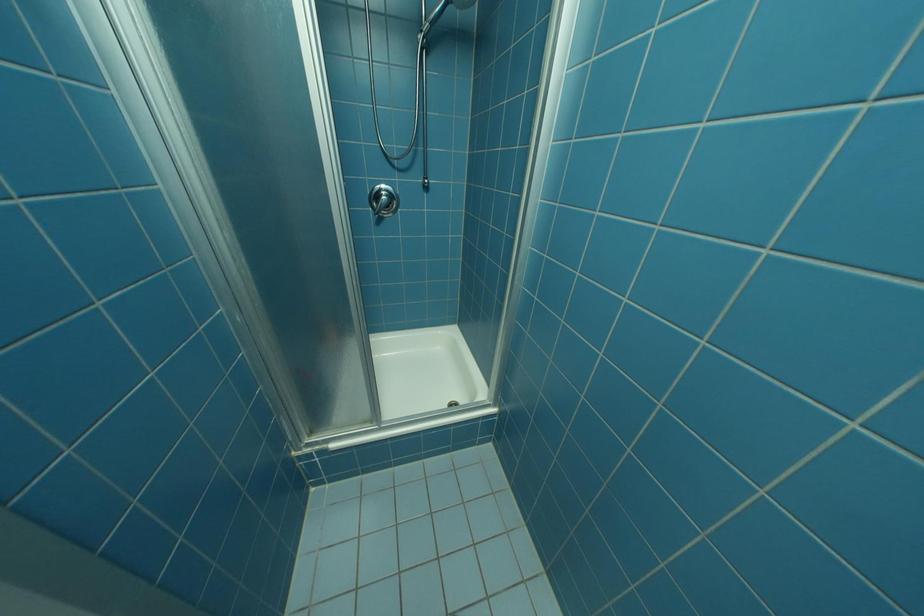
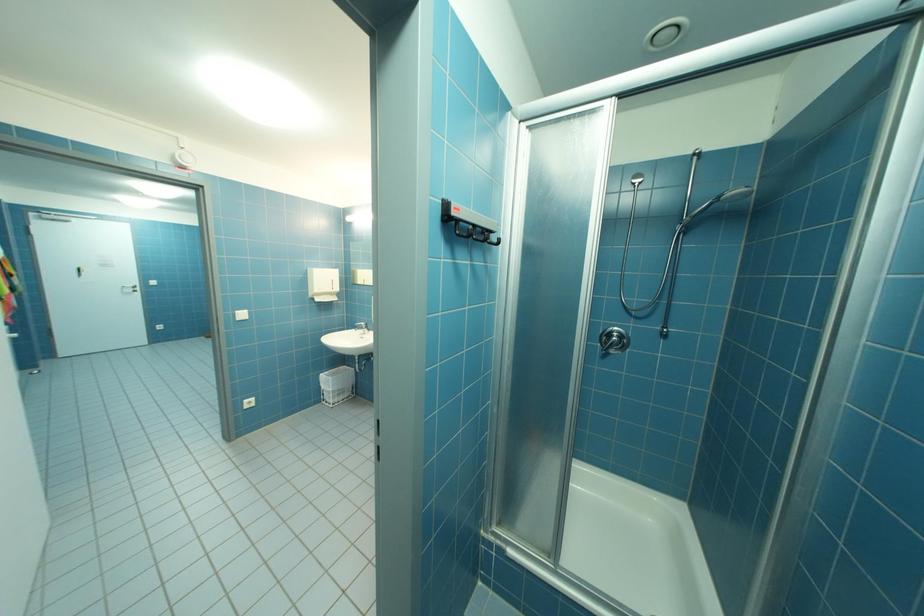
Question: Based on the continuous images, in which direction is the camera rotating? Reply with the corresponding letter.

Choices:
 (A) Left
 (B) Right
 (C) Up
 (D) Down

Answer: (A)